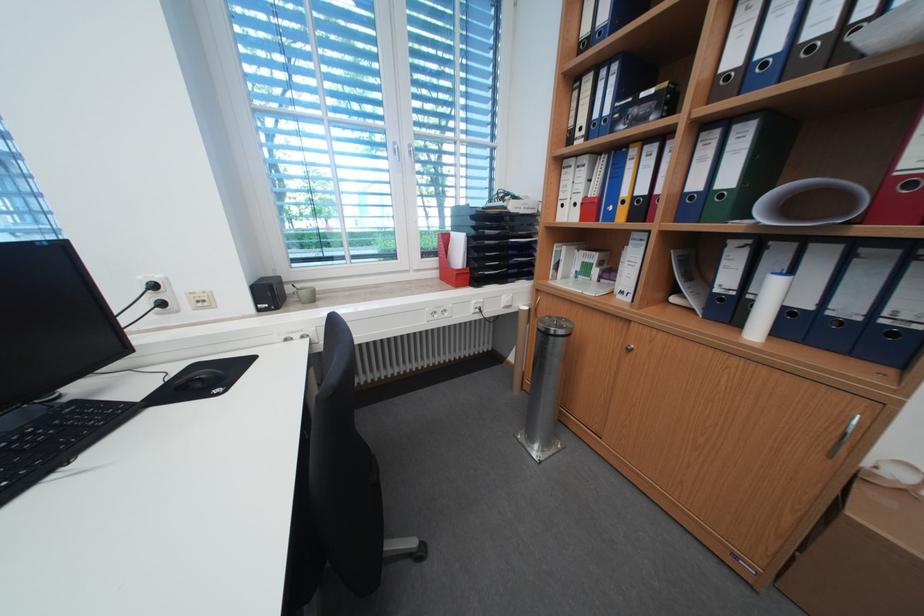
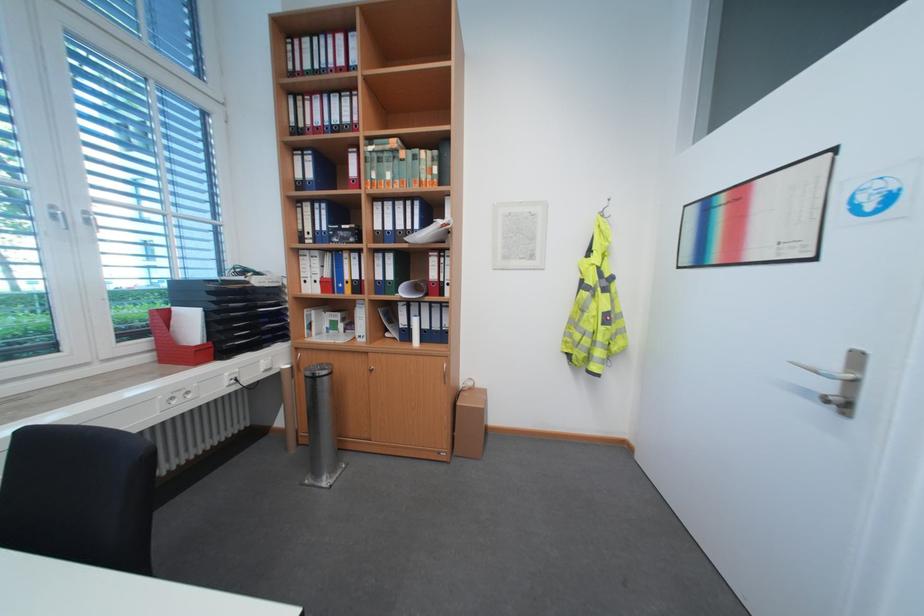
The point at (537, 309) is marked in the first image. Where is the corresponding point in the second image?

(299, 367)